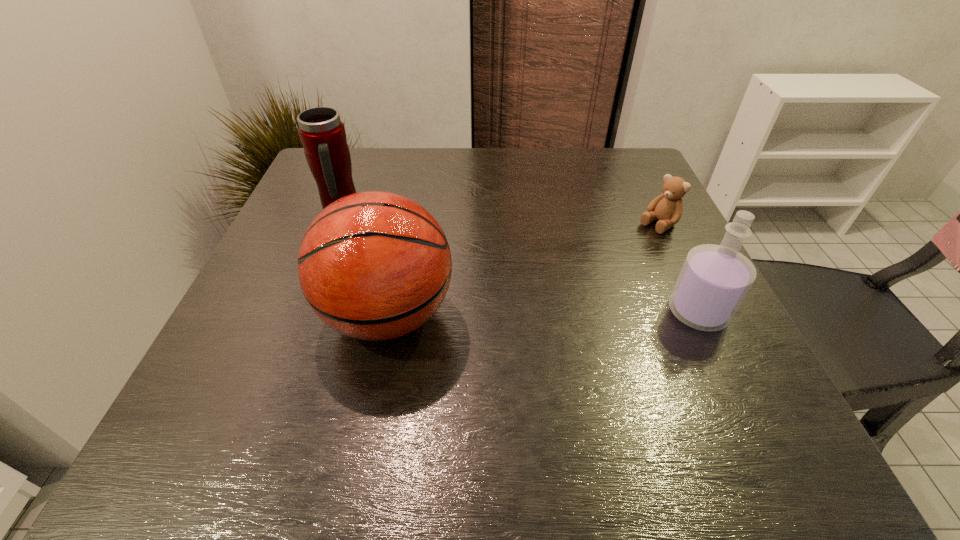
The height and width of the screenshot is (540, 960). In order to click on vacant space on the desktop that is between the basketball and the perfume and is positioned on the side with the handle of the thermos bottle in this screenshot , I will do `click(569, 313)`.

Where is `vacant space on the desktop that is between the basketball and the perfume and is positioned on the front-facing side of the shortest object`? Image resolution: width=960 pixels, height=540 pixels. vacant space on the desktop that is between the basketball and the perfume and is positioned on the front-facing side of the shortest object is located at coordinates (532, 314).